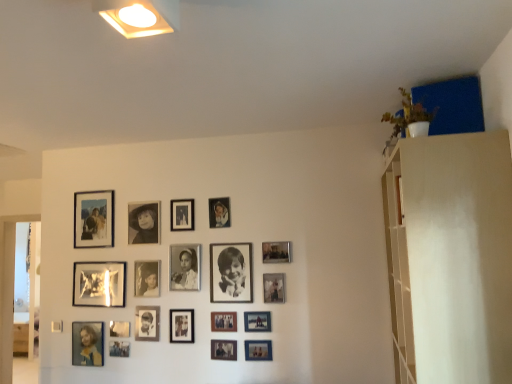
Question: From a real-world perspective, is black matte photo frame at center, acting as the ninth picture frame starting from the right, below black matte photo frame at upper center, acting as the fourteenth picture frame starting from the right?

Choices:
 (A) no
 (B) yes

Answer: (B)

Question: Does black matte photo frame at center, acting as the ninth picture frame starting from the right, have a smaller size compared to black matte photo frame at upper center, acting as the fourteenth picture frame starting from the right?

Choices:
 (A) no
 (B) yes

Answer: (A)

Question: Is black matte photo frame at center, which ranks as the eleventh picture frame in left-to-right order, in front of black matte photo frame at upper center, acting as the fourteenth picture frame starting from the right?

Choices:
 (A) no
 (B) yes

Answer: (B)

Question: Considering the relative sizes of black matte photo frame at center, acting as the ninth picture frame starting from the right, and black matte photo frame at upper center, positioned as the sixth picture frame in left-to-right order, in the image provided, is black matte photo frame at center, acting as the ninth picture frame starting from the right, bigger than black matte photo frame at upper center, positioned as the sixth picture frame in left-to-right order,?

Choices:
 (A) yes
 (B) no

Answer: (A)

Question: Are black matte photo frame at center, which ranks as the eleventh picture frame in left-to-right order, and black matte photo frame at upper center, positioned as the sixth picture frame in left-to-right order, making contact?

Choices:
 (A) no
 (B) yes

Answer: (A)

Question: Considering the positions of point (118, 332) and point (467, 317), is point (118, 332) closer or farther from the camera than point (467, 317)?

Choices:
 (A) farther
 (B) closer

Answer: (A)

Question: In the image, is metallic silver picture frame at center, the 16th picture frame positioned from the right, positioned in front of or behind white matte shelf at upper right?

Choices:
 (A) front
 (B) behind

Answer: (B)

Question: Looking at their shapes, would you say metallic silver picture frame at center, acting as the 4th picture frame starting from the left, is wider or thinner than white matte shelf at upper right?

Choices:
 (A) wide
 (B) thin

Answer: (B)

Question: Is metallic silver picture frame at center, the 16th picture frame positioned from the right, inside or outside of white matte shelf at upper right?

Choices:
 (A) inside
 (B) outside

Answer: (B)

Question: From a real-world perspective, is metallic silver photo frame at center, which is the fourteenth picture frame in left-to-right order, physically located above or below matte blue photo frame at lower left, which is the 19th picture frame from right to left?

Choices:
 (A) below
 (B) above

Answer: (A)

Question: From the image's perspective, is metallic silver photo frame at center, the 6th picture frame from the right, located above or below matte blue photo frame at lower left, acting as the first picture frame starting from the left?

Choices:
 (A) below
 (B) above

Answer: (B)

Question: In terms of width, does metallic silver photo frame at center, the 6th picture frame from the right, look wider or thinner when compared to matte blue photo frame at lower left, acting as the first picture frame starting from the left?

Choices:
 (A) wide
 (B) thin

Answer: (B)

Question: Is point pyautogui.click(x=218, y=352) positioned closer to the camera than point pyautogui.click(x=95, y=337)?

Choices:
 (A) farther
 (B) closer

Answer: (B)

Question: Is metallic silver picture frame at center, acting as the 4th picture frame starting from the left, taller or shorter than matte blue photo frame at lower left, which is the 19th picture frame from right to left?

Choices:
 (A) short
 (B) tall

Answer: (A)

Question: Considering their positions, is metallic silver picture frame at center, the 16th picture frame positioned from the right, located in front of or behind matte blue photo frame at lower left, acting as the first picture frame starting from the left?

Choices:
 (A) behind
 (B) front

Answer: (B)